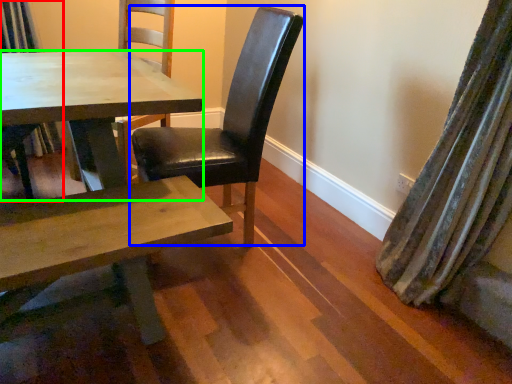
Question: Based on their relative distances, which object is farther from chair (highlighted by a red box)? Choose from chair (highlighted by a blue box) and kitchen & dining room table (highlighted by a green box).

Choices:
 (A) chair
 (B) kitchen & dining room table

Answer: (A)